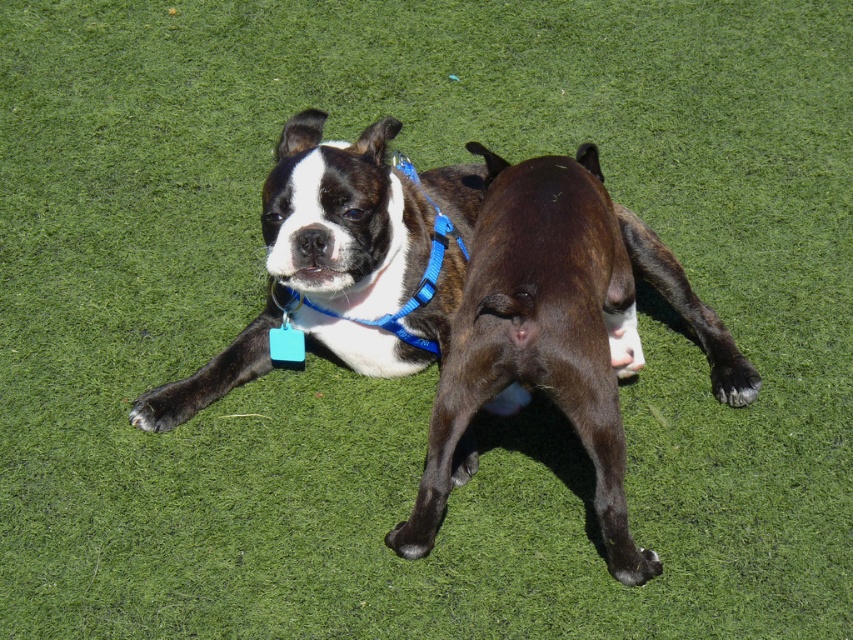
You are a dog owner who wants to buy a new collar for your shiny black dog at center and brown matte dog at center. The store has collars labeled for small dogs and large dogs. According to the scene, which collar size should each dog get?

The shiny black dog at center is shorter than the brown matte dog at center, so the shiny black dog at center should get a small collar and the brown matte dog at center should get a large collar.

You are a photographer trying to capture the perfect shot of the Boston Terrier. You notice two points in the scene labeled as point (427, 339) and point (415, 529). Which point is closer to your camera lens?

Point (427, 339) is further to the camera than point (415, 529). Therefore, point (415, 529) is closer to the camera lens.